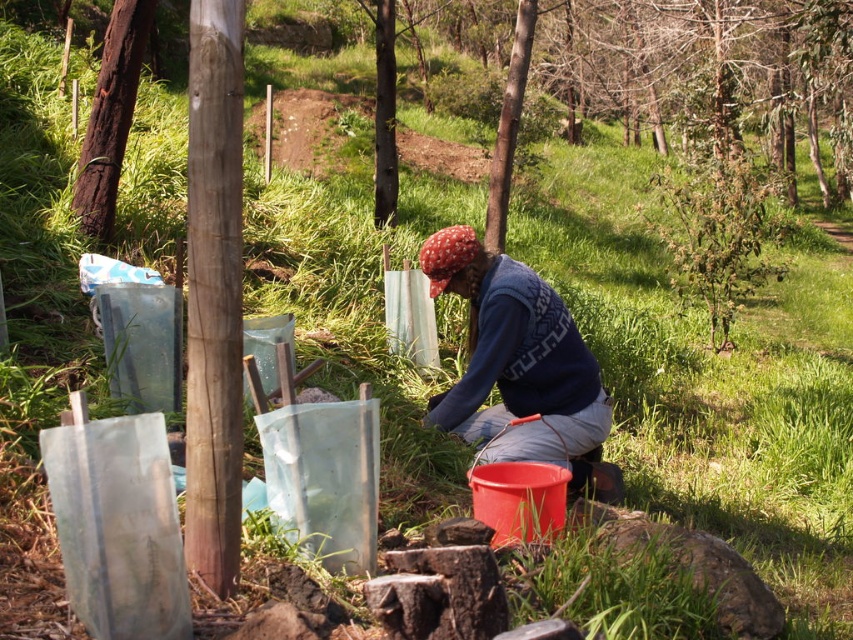
You are standing at the point labeled as point (80, 211) and want to reach the point labeled as point (519, 387). Which direction should you move to get there?

You should move forward because point (519, 387) is in front of point (80, 211).

You are a drone operator trying to capture a photo of the blue knitted sweater at center. The camera is currently focused on the point at coordinates 0.5, 0.5. Should you adjust the camera focus to point at (519,365) to get a clearer image of the blue knitted sweater at center?

Yes, the blue knitted sweater at center is located at point (519,365), so adjusting the camera focus to that coordinate will ensure a clearer image.